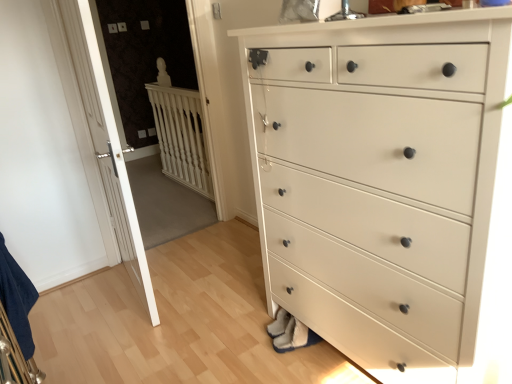
Question: From a real-world perspective, does white wood balustrade at upper left stand above white painted wood chest of drawers at center?

Choices:
 (A) yes
 (B) no

Answer: (B)

Question: Does white wood balustrade at upper left have a larger size compared to white painted wood chest of drawers at center?

Choices:
 (A) no
 (B) yes

Answer: (A)

Question: Can we say white wood balustrade at upper left lies outside white painted wood chest of drawers at center?

Choices:
 (A) no
 (B) yes

Answer: (B)

Question: Is the depth of white wood balustrade at upper left less than that of white painted wood chest of drawers at center?

Choices:
 (A) no
 (B) yes

Answer: (A)

Question: Can you confirm if white wood balustrade at upper left is positioned to the left of white painted wood chest of drawers at center?

Choices:
 (A) yes
 (B) no

Answer: (A)

Question: Is white wood balustrade at upper left smaller than white painted wood chest of drawers at center?

Choices:
 (A) no
 (B) yes

Answer: (B)

Question: Is white wood balustrade at upper left not near white wooden door at left?

Choices:
 (A) yes
 (B) no

Answer: (A)

Question: Is white wood balustrade at upper left aimed at white wooden door at left?

Choices:
 (A) yes
 (B) no

Answer: (B)

Question: Is white wood balustrade at upper left bigger than white wooden door at left?

Choices:
 (A) no
 (B) yes

Answer: (A)

Question: From the image's perspective, would you say white wood balustrade at upper left is positioned over white wooden door at left?

Choices:
 (A) yes
 (B) no

Answer: (A)

Question: Can you confirm if white wood balustrade at upper left is positioned to the right of white wooden door at left?

Choices:
 (A) no
 (B) yes

Answer: (B)

Question: From a real-world perspective, is white wood balustrade at upper left beneath white wooden door at left?

Choices:
 (A) yes
 (B) no

Answer: (A)

Question: Is white painted wood chest of drawers at center next to white wooden door at left and touching it?

Choices:
 (A) yes
 (B) no

Answer: (B)